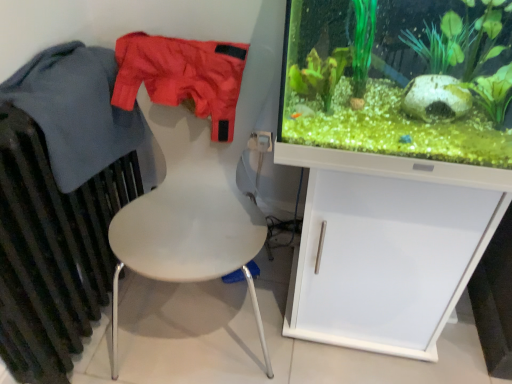
Measure the distance between point (x=90, y=105) and camera.

They are 1.08 meters apart.

What do you see at coordinates (189, 232) in the screenshot? I see `white plastic chair at center` at bounding box center [189, 232].

What is the approximate width of white plastic chair at center?

The width of white plastic chair at center is 56.08 centimeters.

From the picture: Measure the distance between dark gray metallic radiator at left and camera.

dark gray metallic radiator at left is 34.14 inches from camera.

Where is `matte nylon shorts at upper left, the second clothing in the left-to-right sequence`? matte nylon shorts at upper left, the second clothing in the left-to-right sequence is located at coordinates (182, 76).

This screenshot has width=512, height=384. Find the location of `blue cotton jacket at left, the second clothing positioned from the right`. blue cotton jacket at left, the second clothing positioned from the right is located at coordinates (82, 114).

From a real-world perspective, is green matte plant at right beneath white plastic chair at center?

No.

Is green matte plant at right turned away from white plastic chair at center?

No.

Is green matte plant at right taller than white plastic chair at center?

No.

From the image's perspective, which is above, green matte plant at right or white plastic chair at center?

green matte plant at right is shown above in the image.

From a real-world perspective, is blue cotton jacket at left, the second clothing positioned from the right, below white plastic chair at center?

Incorrect, from a real-world perspective, blue cotton jacket at left, the second clothing positioned from the right, is higher than white plastic chair at center.

Considering the sizes of blue cotton jacket at left, which is counted as the first clothing, starting from the left, and white plastic chair at center in the image, is blue cotton jacket at left, which is counted as the first clothing, starting from the left, bigger or smaller than white plastic chair at center?

blue cotton jacket at left, which is counted as the first clothing, starting from the left, is smaller than white plastic chair at center.

The height and width of the screenshot is (384, 512). I want to click on clothing that is the 1st object located above the white plastic chair at center (from the image's perspective), so click(x=82, y=114).

Consider the image. Is blue cotton jacket at left, the second clothing positioned from the right, inside or outside of white plastic chair at center?

blue cotton jacket at left, the second clothing positioned from the right, cannot be found inside white plastic chair at center.

In terms of size, does white plastic chair at center appear bigger or smaller than blue cotton jacket at left, the second clothing positioned from the right?

Clearly, white plastic chair at center is larger in size than blue cotton jacket at left, the second clothing positioned from the right.

In the scene shown: From a real-world perspective, which object stands above the other?

From a 3D spatial view, blue cotton jacket at left, the second clothing positioned from the right, is above.

Does white matte cabinet at right have a lesser width compared to dark gray metallic radiator at left?

No, white matte cabinet at right is not thinner than dark gray metallic radiator at left.

Is point (382, 258) closer to camera compared to point (69, 350)?

Yes.

Who is shorter, white matte cabinet at right or dark gray metallic radiator at left?

Standing shorter between the two is white matte cabinet at right.

What are the coordinates of `cabinetry lying in front of the matte nylon shorts at upper left, which is the first clothing in right-to-left order` in the screenshot? It's located at (386, 260).

From their relative heights in the image, would you say white matte cabinet at right is taller or shorter than matte nylon shorts at upper left, the second clothing in the left-to-right sequence?

white matte cabinet at right is taller than matte nylon shorts at upper left, the second clothing in the left-to-right sequence.

Would you say white matte cabinet at right contains matte nylon shorts at upper left, which is the first clothing in right-to-left order?

Actually, matte nylon shorts at upper left, which is the first clothing in right-to-left order, is outside white matte cabinet at right.

Which is more to the right, white matte cabinet at right or matte nylon shorts at upper left, the second clothing in the left-to-right sequence?

→ white matte cabinet at right.

Consider the image. From the image's perspective, is white plastic chair at center under matte nylon shorts at upper left, which is the first clothing in right-to-left order?

Yes, from the image's perspective, white plastic chair at center is below matte nylon shorts at upper left, which is the first clothing in right-to-left order.

Considering the positions of objects white plastic chair at center and matte nylon shorts at upper left, which is the first clothing in right-to-left order, in the image provided, who is more to the left, white plastic chair at center or matte nylon shorts at upper left, which is the first clothing in right-to-left order,?

Positioned to the left is matte nylon shorts at upper left, which is the first clothing in right-to-left order.

Is point (193, 182) farther from camera compared to point (242, 47)?

Yes.

Considering the positions of objects blue cotton jacket at left, which is counted as the first clothing, starting from the left, and green matte plant at right in the image provided, who is more to the right, blue cotton jacket at left, which is counted as the first clothing, starting from the left, or green matte plant at right?

green matte plant at right is more to the right.

Can you confirm if blue cotton jacket at left, which is counted as the first clothing, starting from the left, is shorter than green matte plant at right?

Yes, blue cotton jacket at left, which is counted as the first clothing, starting from the left, is shorter than green matte plant at right.

Can you tell me how much blue cotton jacket at left, the second clothing positioned from the right, and green matte plant at right differ in facing direction?

There is a 89.1-degree angle between the facing directions of blue cotton jacket at left, the second clothing positioned from the right, and green matte plant at right.

Is blue cotton jacket at left, which is counted as the first clothing, starting from the left, positioned with its back to green matte plant at right?

That's not correct — blue cotton jacket at left, which is counted as the first clothing, starting from the left, is not looking away from green matte plant at right.

Where is `chair below the green matte plant at right (from the image's perspective)`? Image resolution: width=512 pixels, height=384 pixels. chair below the green matte plant at right (from the image's perspective) is located at coordinates (189, 232).

At what (x,y) coordinates should I click in order to perform the action: click on chair on the right of blue cotton jacket at left, which is counted as the first clothing, starting from the left. Please return your answer as a coordinate pair (x, y). The image size is (512, 384). Looking at the image, I should click on (189, 232).

When comparing their distances from dark gray metallic radiator at left, does white matte cabinet at right or green matte plant at right seem further?

Among the two, green matte plant at right is located further to dark gray metallic radiator at left.

Looking at the image, which one is located closer to blue cotton jacket at left, which is counted as the first clothing, starting from the left, matte nylon shorts at upper left, which is the first clothing in right-to-left order, or white plastic chair at center?

matte nylon shorts at upper left, which is the first clothing in right-to-left order, lies closer to blue cotton jacket at left, which is counted as the first clothing, starting from the left, than the other object.

Based on the photo, when comparing their distances from white matte cabinet at right, does green matte plant at right or dark gray metallic radiator at left seem further?

The object further to white matte cabinet at right is dark gray metallic radiator at left.

Which object lies further to the anchor point white plastic chair at center, white matte cabinet at right or green matte plant at right?

green matte plant at right lies further to white plastic chair at center than the other object.

Consider the image. Based on their spatial positions, is white matte cabinet at right or matte nylon shorts at upper left, which is the first clothing in right-to-left order, further from dark gray metallic radiator at left?

white matte cabinet at right is further to dark gray metallic radiator at left.

Considering their positions, is green matte plant at right positioned further to white plastic chair at center than dark gray metallic radiator at left?

green matte plant at right.

In the scene shown: Estimate the real-world distances between objects in this image. Which object is further from dark gray metallic radiator at left, white matte cabinet at right or blue cotton jacket at left, which is counted as the first clothing, starting from the left?

white matte cabinet at right.

Which object lies further to the anchor point white matte cabinet at right, green matte plant at right or white plastic chair at center?

Based on the image, green matte plant at right appears to be further to white matte cabinet at right.

At what (x,y) coordinates should I click in order to perform the action: click on clothing located between blue cotton jacket at left, the second clothing positioned from the right, and white matte cabinet at right in the left-right direction. Please return your answer as a coordinate pair (x, y). This screenshot has width=512, height=384. Looking at the image, I should click on pyautogui.click(x=182, y=76).

Locate an element on the screen. The width and height of the screenshot is (512, 384). chair situated between dark gray metallic radiator at left and green matte plant at right from left to right is located at coordinates (189, 232).

Image resolution: width=512 pixels, height=384 pixels. I want to click on clothing located between blue cotton jacket at left, which is counted as the first clothing, starting from the left, and green matte plant at right in the left-right direction, so click(x=182, y=76).

Where is `clothing between matte nylon shorts at upper left, which is the first clothing in right-to-left order, and white plastic chair at center in the up-down direction`? Image resolution: width=512 pixels, height=384 pixels. clothing between matte nylon shorts at upper left, which is the first clothing in right-to-left order, and white plastic chair at center in the up-down direction is located at coordinates (82, 114).